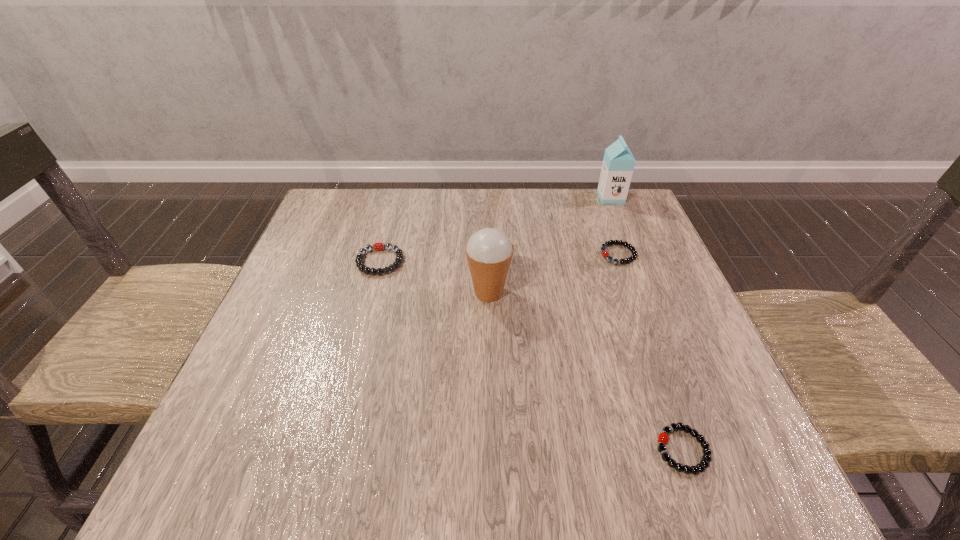
This screenshot has width=960, height=540. I want to click on milk carton, so click(x=618, y=164).

Where is `icecream`? The width and height of the screenshot is (960, 540). icecream is located at coordinates (489, 251).

Image resolution: width=960 pixels, height=540 pixels. In order to click on the fourth object from right to left in this screenshot , I will do `click(489, 251)`.

You are a GUI agent. You are given a task and a screenshot of the screen. Output one action in this format:
    pyautogui.click(x=<x>, y=<y>)
    Task: Click on the third tallest object
    The image size is (960, 540).
    Given the screenshot: What is the action you would take?
    pyautogui.click(x=378, y=246)

Identify the location of the leftmost bracelet. (378, 246).

Where is `the nearest bracelet`? This screenshot has width=960, height=540. the nearest bracelet is located at coordinates pos(663,438).

The width and height of the screenshot is (960, 540). I want to click on free space located 0.360m on the left of the milk carton, so click(476, 197).

You are a GUI agent. You are given a task and a screenshot of the screen. Output one action in this format:
    pyautogui.click(x=<x>, y=<y>)
    Task: Click on the vacant region located on the front of the icecream
    The image size is (960, 540).
    Given the screenshot: What is the action you would take?
    492,407

At what (x,y) coordinates should I click in order to perform the action: click on free space located 0.110m on the right of the leftmost object. Please return your answer as a coordinate pair (x, y). The height and width of the screenshot is (540, 960). Looking at the image, I should click on (449, 261).

Locate an element on the screen. This screenshot has width=960, height=540. vacant space situated on the back of the nearest bracelet is located at coordinates (639, 328).